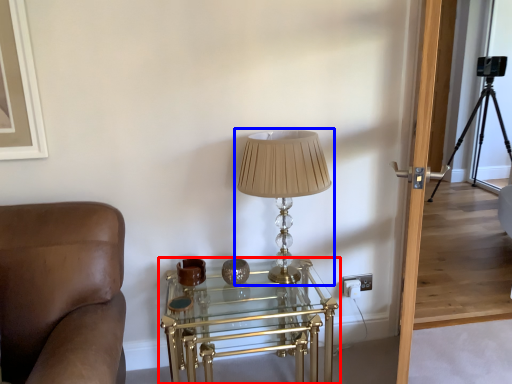
Question: Among these objects, which one is nearest to the camera, table (highlighted by a red box) or lamp (highlighted by a blue box)?

Choices:
 (A) table
 (B) lamp

Answer: (B)